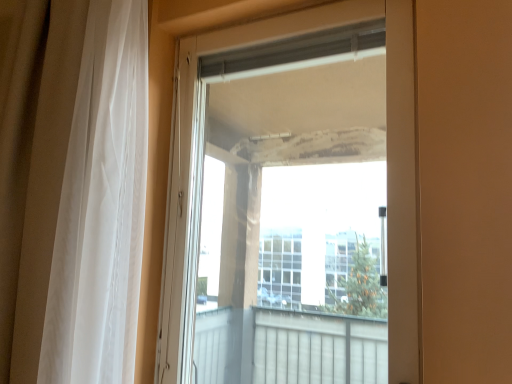
Describe the element at coordinates (101, 206) in the screenshot. I see `white sheer curtain at left` at that location.

What is the approximate height of white sheer curtain at left?

4.80 feet.

What are the coordinates of `white sheer curtain at left` in the screenshot? It's located at (101, 206).

Describe the element at coordinates (387, 167) in the screenshot. I see `transparent glass door at center` at that location.

Identify the location of transparent glass door at center. This screenshot has height=384, width=512. (387, 167).

I want to click on white sheer curtain at left, so click(x=101, y=206).

Does white sheer curtain at left appear on the right side of transparent glass door at center?

No.

In the image, is white sheer curtain at left positioned in front of or behind transparent glass door at center?

white sheer curtain at left is positioned closer to the viewer than transparent glass door at center.

Does point (120, 50) appear closer or farther from the camera than point (166, 285)?

Point (120, 50) is closer to the camera than point (166, 285).

From the image's perspective, does white sheer curtain at left appear lower than transparent glass door at center?

Incorrect, from the image's perspective, white sheer curtain at left is higher than transparent glass door at center.

From a real-world perspective, between white sheer curtain at left and transparent glass door at center, who is vertically lower?

From a 3D spatial view, transparent glass door at center is below.

Considering the relative sizes of white sheer curtain at left and transparent glass door at center in the image provided, is white sheer curtain at left thinner than transparent glass door at center?

No, white sheer curtain at left is not thinner than transparent glass door at center.

Can you confirm if white sheer curtain at left is taller than transparent glass door at center?

Yes.

Between white sheer curtain at left and transparent glass door at center, which one has smaller size?

transparent glass door at center is smaller.

Is white sheer curtain at left completely or partially outside of transparent glass door at center?

Yes, white sheer curtain at left is not within transparent glass door at center.

Is white sheer curtain at left far from transparent glass door at center?

Actually, white sheer curtain at left and transparent glass door at center are a little close together.

Is white sheer curtain at left positioned with its back to transparent glass door at center?

No, white sheer curtain at left is not facing away from transparent glass door at center.

What's the angular difference between white sheer curtain at left and transparent glass door at center's facing directions?

The facing directions of white sheer curtain at left and transparent glass door at center are 1.75 degrees apart.

Measure the distance between white sheer curtain at left and transparent glass door at center.

The distance of white sheer curtain at left from transparent glass door at center is 15.86 inches.

Locate an element on the screen. This screenshot has width=512, height=384. door behind the white sheer curtain at left is located at coordinates (x=387, y=167).

Which object is positioned more to the left, transparent glass door at center or white sheer curtain at left?

Positioned to the left is white sheer curtain at left.

Is transparent glass door at center further to camera compared to white sheer curtain at left?

Yes.

Is point (411, 242) closer or farther from the camera than point (98, 191)?

Point (411, 242) appears to be farther away from the viewer than point (98, 191).

From the image's perspective, is transparent glass door at center located above or below white sheer curtain at left?

transparent glass door at center is situated lower than white sheer curtain at left in the image.

From a real-world perspective, between transparent glass door at center and white sheer curtain at left, who is vertically lower?

From a 3D spatial view, transparent glass door at center is below.

Is transparent glass door at center wider or thinner than white sheer curtain at left?

Considering their sizes, transparent glass door at center looks slimmer than white sheer curtain at left.

Considering the relative sizes of transparent glass door at center and white sheer curtain at left in the image provided, is transparent glass door at center taller than white sheer curtain at left?

In fact, transparent glass door at center may be shorter than white sheer curtain at left.

Who is bigger, transparent glass door at center or white sheer curtain at left?

white sheer curtain at left.

Is transparent glass door at center outside of white sheer curtain at left?

Yes, transparent glass door at center is outside of white sheer curtain at left.

Is transparent glass door at center placed right next to white sheer curtain at left?

They are not placed beside each other.

Could you tell me if transparent glass door at center is turned towards white sheer curtain at left?

No, transparent glass door at center is not aimed at white sheer curtain at left.

How distant is transparent glass door at center from white sheer curtain at left?

A distance of 40.28 centimeters exists between transparent glass door at center and white sheer curtain at left.

At what (x,y) coordinates should I click in order to perform the action: click on curtain that is above the transparent glass door at center (from a real-world perspective). Please return your answer as a coordinate pair (x, y). The image size is (512, 384). Looking at the image, I should click on (101, 206).

Find the location of a particular element. The image size is (512, 384). curtain on the left of transparent glass door at center is located at coordinates (101, 206).

Identify the location of curtain in front of the transparent glass door at center. (101, 206).